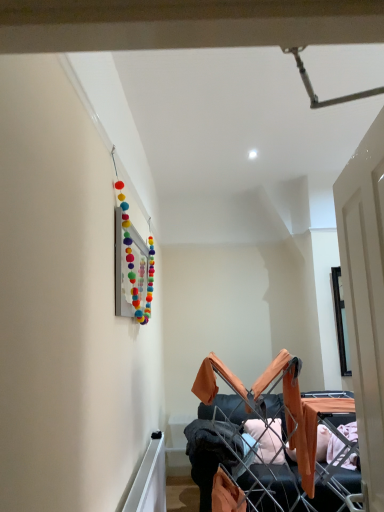
The image size is (384, 512). Describe the element at coordinates (215, 449) in the screenshot. I see `dark gray fabric at center` at that location.

Identify the location of white wooden door at right. The width and height of the screenshot is (384, 512). (365, 295).

Find the location of a particular element. The width and height of the screenshot is (384, 512). dark gray fabric at center is located at coordinates (215, 449).

Considering their positions, is orange fabric drying rack at lower right located in front of or behind white wooden door at right?

In the image, orange fabric drying rack at lower right appears behind white wooden door at right.

Between orange fabric drying rack at lower right and white wooden door at right, which one has more height?

Standing taller between the two is white wooden door at right.

How different are the orientations of orange fabric drying rack at lower right and white wooden door at right in degrees?

There is a 93.9-degree angle between the facing directions of orange fabric drying rack at lower right and white wooden door at right.

Is white wooden door at right far away from orange fabric drying rack at lower right?

white wooden door at right is positioned a significant distance from orange fabric drying rack at lower right.

This screenshot has height=512, width=384. Identify the location of furniture below the white wooden door at right (from the image's perspective). (270, 486).

Looking at this image, which of these two, white wooden door at right or orange fabric drying rack at lower right, is thinner?

Thinner between the two is white wooden door at right.

Is point (369, 217) farther from camera compared to point (346, 477)?

No, it is not.

Which object is positioned more to the right, dark gray fabric at center or orange fabric drying rack at lower right?

orange fabric drying rack at lower right is more to the right.

Considering the sizes of objects dark gray fabric at center and orange fabric drying rack at lower right in the image provided, who is thinner, dark gray fabric at center or orange fabric drying rack at lower right?

dark gray fabric at center is thinner.

Is dark gray fabric at center positioned in front of orange fabric drying rack at lower right?

No, dark gray fabric at center is behind orange fabric drying rack at lower right.

Which of these two, dark gray fabric at center or orange fabric drying rack at lower right, stands taller?

orange fabric drying rack at lower right is taller.

Is white wooden door at right completely or partially outside of dark gray fabric at center?

Indeed, white wooden door at right is completely outside dark gray fabric at center.

Which is behind, white wooden door at right or dark gray fabric at center?

dark gray fabric at center is more distant.

From the image's perspective, between white wooden door at right and dark gray fabric at center, which one is located above?

white wooden door at right.

Locate an element on the screen. clothing behind the white wooden door at right is located at coordinates (215, 449).

Is dark gray fabric at center spatially inside white wooden door at right, or outside of it?

dark gray fabric at center is located beyond the bounds of white wooden door at right.

Is dark gray fabric at center taller than white wooden door at right?

No, dark gray fabric at center is not taller than white wooden door at right.

You are a GUI agent. You are given a task and a screenshot of the screen. Output one action in this format:
    pyautogui.click(x=<x>, y=<y>)
    Task: Click on the door that appears in front of the dark gray fabric at center
    
    Given the screenshot: What is the action you would take?
    pyautogui.click(x=365, y=295)

Which point is more forward, (252, 493) or (227, 423)?

The point (252, 493) is more forward.

Visually, is orange fabric drying rack at lower right positioned to the left or to the right of dark gray fabric at center?

orange fabric drying rack at lower right is positioned on dark gray fabric at center's right side.

Who is more distant, orange fabric drying rack at lower right or dark gray fabric at center?

dark gray fabric at center is further away from the camera.

The width and height of the screenshot is (384, 512). Find the location of `furniture on the right side of white wooden door at right`. furniture on the right side of white wooden door at right is located at coordinates (270, 486).

This screenshot has width=384, height=512. Find the location of `door to the left of orange fabric drying rack at lower right`. door to the left of orange fabric drying rack at lower right is located at coordinates (365, 295).

Looking at the image, which one is located further to orange fabric drying rack at lower right, white wooden door at right or dark gray fabric at center?

Among the two, white wooden door at right is located further to orange fabric drying rack at lower right.

From the image, which object appears to be nearer to dark gray fabric at center, orange fabric drying rack at lower right or white wooden door at right?

orange fabric drying rack at lower right is positioned closer to the anchor dark gray fabric at center.

Which object lies nearer to the anchor point white wooden door at right, dark gray fabric at center or orange fabric drying rack at lower right?

Based on the image, orange fabric drying rack at lower right appears to be nearer to white wooden door at right.

Looking at the image, which one is located further to orange fabric drying rack at lower right, dark gray fabric at center or white wooden door at right?

The object further to orange fabric drying rack at lower right is white wooden door at right.

Which object lies further to the anchor point white wooden door at right, orange fabric drying rack at lower right or dark gray fabric at center?

dark gray fabric at center.

Which object lies further to the anchor point dark gray fabric at center, white wooden door at right or orange fabric drying rack at lower right?

white wooden door at right is positioned further to the anchor dark gray fabric at center.

At what (x,y) coordinates should I click in order to perform the action: click on furniture between white wooden door at right and dark gray fabric at center in the front-back direction. Please return your answer as a coordinate pair (x, y). Looking at the image, I should click on (270, 486).